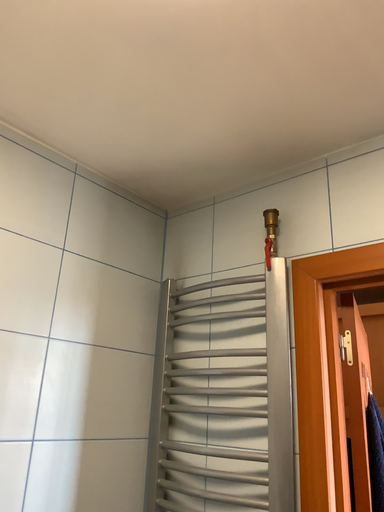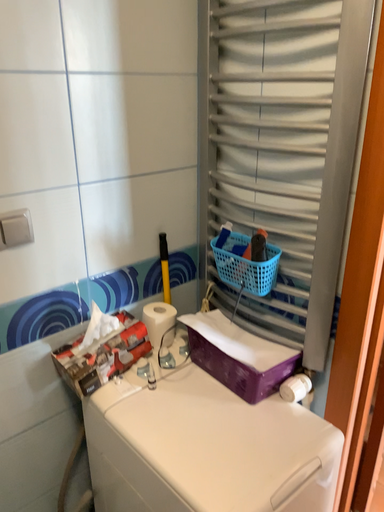
Question: Which way did the camera rotate in the video?

Choices:
 (A) rotated upward
 (B) rotated downward

Answer: (B)